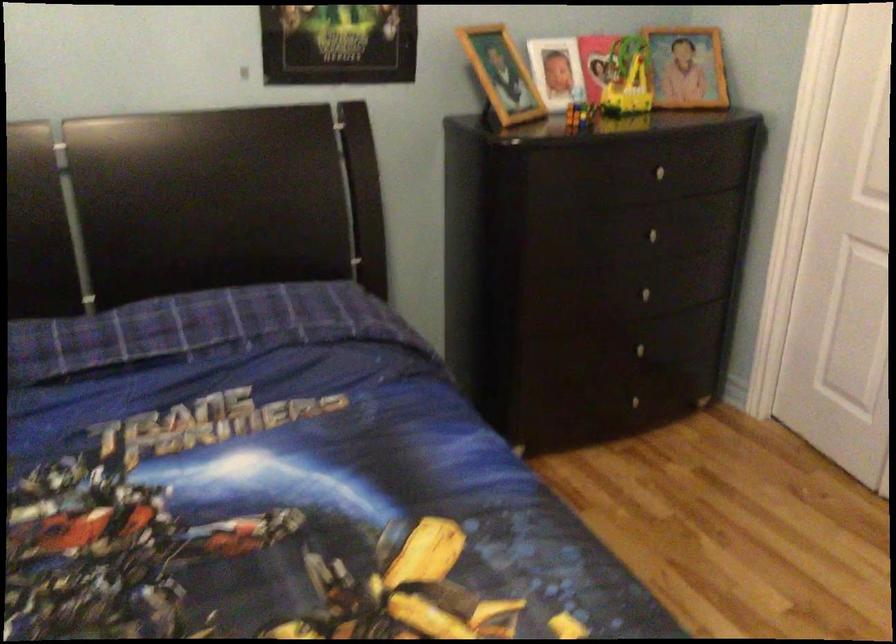
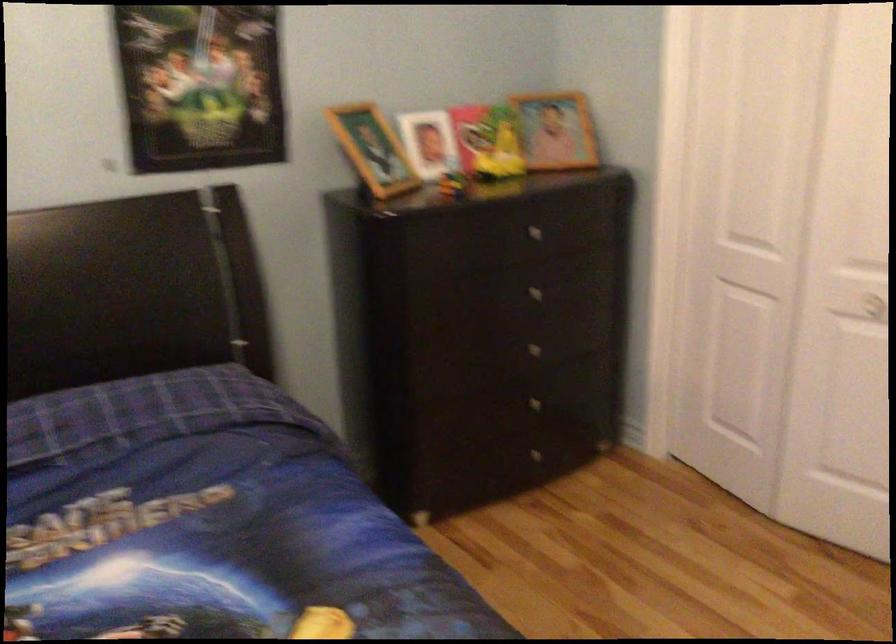
Where in the second image is the point corresponding to [632,350] from the first image?

(528, 406)